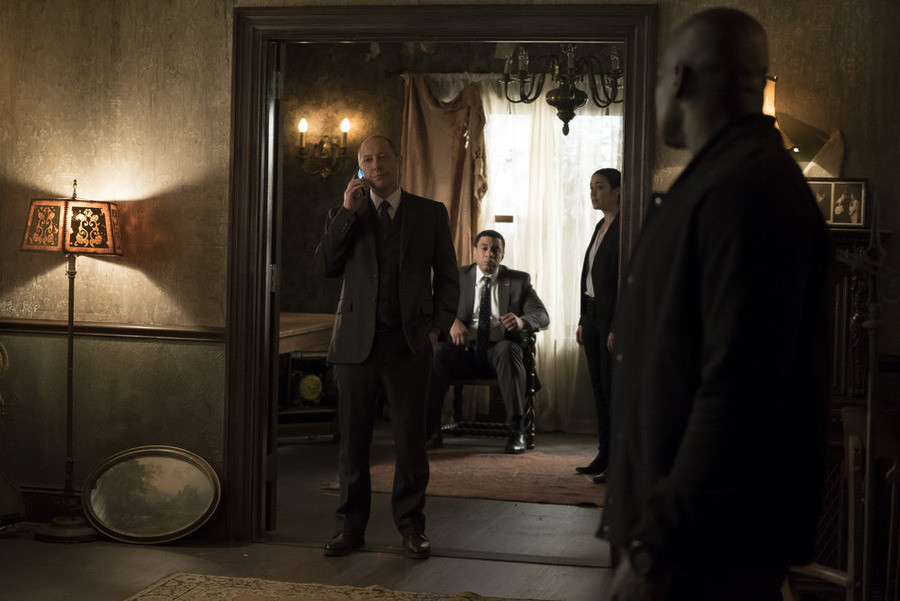
The height and width of the screenshot is (601, 900). What are the coordinates of `wall` in the screenshot? It's located at (106, 121).